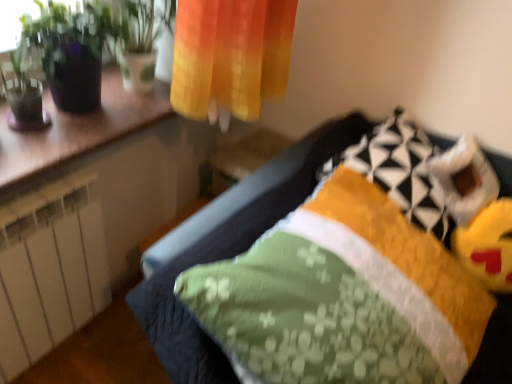
Question: Is yellow plush toy at lower right touching wooden counter at upper left?

Choices:
 (A) yes
 (B) no

Answer: (B)

Question: Is yellow plush toy at lower right far from wooden counter at upper left?

Choices:
 (A) yes
 (B) no

Answer: (A)

Question: Is yellow plush toy at lower right thinner than wooden counter at upper left?

Choices:
 (A) yes
 (B) no

Answer: (A)

Question: Does yellow plush toy at lower right have a larger size compared to wooden counter at upper left?

Choices:
 (A) yes
 (B) no

Answer: (B)

Question: Considering the relative positions of yellow plush toy at lower right and wooden counter at upper left in the image provided, is yellow plush toy at lower right in front of wooden counter at upper left?

Choices:
 (A) yes
 (B) no

Answer: (B)

Question: Considering the relative positions of yellow plush toy at lower right and wooden counter at upper left in the image provided, is yellow plush toy at lower right to the left of wooden counter at upper left from the viewer's perspective?

Choices:
 (A) yes
 (B) no

Answer: (B)

Question: Is yellow quilted pillow at upper right, the first pillow from the top, looking in the opposite direction of yellow plush toy at lower right?

Choices:
 (A) no
 (B) yes

Answer: (A)

Question: Is yellow quilted pillow at upper right, the first pillow from the top, not close to yellow plush toy at lower right?

Choices:
 (A) yes
 (B) no

Answer: (B)

Question: Considering the relative sizes of yellow quilted pillow at upper right, the first pillow from the top, and yellow plush toy at lower right in the image provided, is yellow quilted pillow at upper right, the first pillow from the top, wider than yellow plush toy at lower right?

Choices:
 (A) yes
 (B) no

Answer: (A)

Question: From the image's perspective, is yellow quilted pillow at upper right, the first pillow from the top, on top of yellow plush toy at lower right?

Choices:
 (A) yes
 (B) no

Answer: (A)

Question: Is yellow quilted pillow at upper right, arranged as the 2th pillow when ordered from the bottom, positioned in front of yellow plush toy at lower right?

Choices:
 (A) yes
 (B) no

Answer: (A)

Question: Is yellow quilted pillow at upper right, the first pillow from the top, shorter than yellow plush toy at lower right?

Choices:
 (A) yes
 (B) no

Answer: (B)

Question: Is green fabric pillow at center, the 1th pillow positioned from the bottom, thinner than yellow quilted pillow at upper right, the first pillow from the top?

Choices:
 (A) no
 (B) yes

Answer: (A)